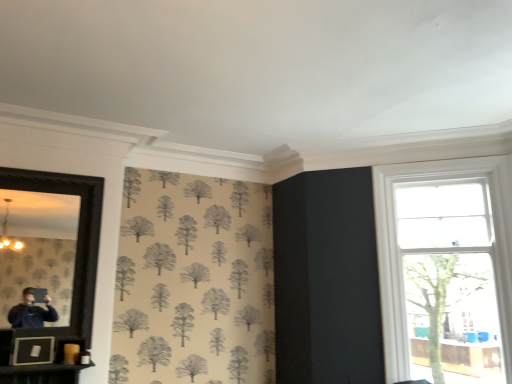
Question: Is clear glass window at right behind black framed mirror at left?

Choices:
 (A) no
 (B) yes

Answer: (B)

Question: Is there a large distance between clear glass window at right and black framed mirror at left?

Choices:
 (A) yes
 (B) no

Answer: (A)

Question: Considering the relative positions of clear glass window at right and black framed mirror at left in the image provided, is clear glass window at right to the right of black framed mirror at left from the viewer's perspective?

Choices:
 (A) no
 (B) yes

Answer: (B)

Question: Can you confirm if clear glass window at right is thinner than black framed mirror at left?

Choices:
 (A) no
 (B) yes

Answer: (A)

Question: Is clear glass window at right next to black framed mirror at left and touching it?

Choices:
 (A) yes
 (B) no

Answer: (B)

Question: Which is correct: matte black picture frame at lower left is inside black framed mirror at left, or outside of it?

Choices:
 (A) inside
 (B) outside

Answer: (A)

Question: Visually, is matte black picture frame at lower left positioned to the left or to the right of black framed mirror at left?

Choices:
 (A) left
 (B) right

Answer: (B)

Question: Considering their positions, is matte black picture frame at lower left located in front of or behind black framed mirror at left?

Choices:
 (A) front
 (B) behind

Answer: (B)

Question: From the image's perspective, is matte black picture frame at lower left located above or below black framed mirror at left?

Choices:
 (A) below
 (B) above

Answer: (A)

Question: Does point (32, 248) appear closer or farther from the camera than point (25, 362)?

Choices:
 (A) farther
 (B) closer

Answer: (A)

Question: From the image's perspective, relative to matte black picture frame at lower left, is black framed mirror at left above or below?

Choices:
 (A) below
 (B) above

Answer: (B)

Question: Considering the positions of black framed mirror at left and matte black picture frame at lower left in the image, is black framed mirror at left wider or thinner than matte black picture frame at lower left?

Choices:
 (A) thin
 (B) wide

Answer: (A)

Question: In terms of size, does black framed mirror at left appear bigger or smaller than matte black picture frame at lower left?

Choices:
 (A) small
 (B) big

Answer: (B)

Question: Is point (44, 347) positioned closer to the camera than point (498, 349)?

Choices:
 (A) farther
 (B) closer

Answer: (B)

Question: Is matte black picture frame at lower left inside the boundaries of clear glass window at right, or outside?

Choices:
 (A) outside
 (B) inside

Answer: (A)